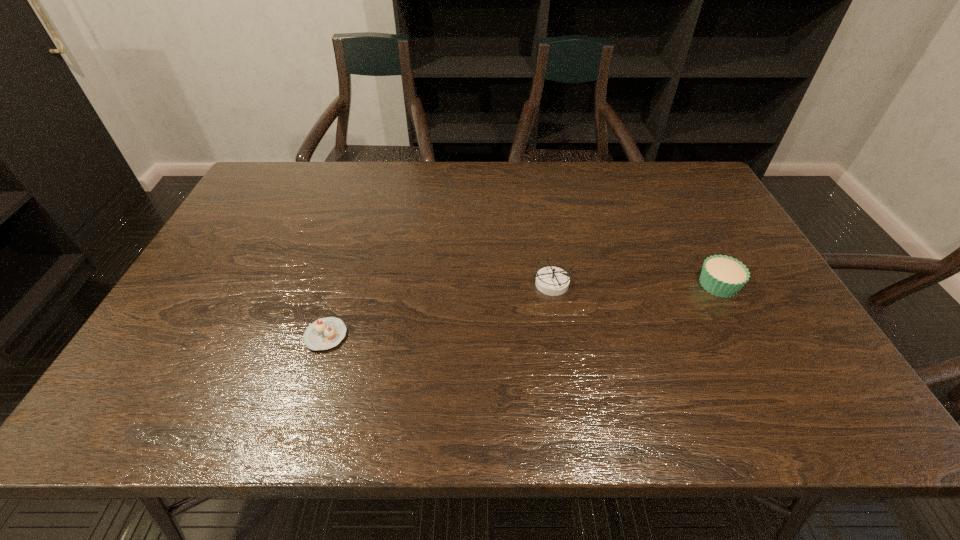
This screenshot has height=540, width=960. In order to click on empty location between the right cupcake and the shortest object in this screenshot , I will do `click(522, 310)`.

The height and width of the screenshot is (540, 960). Identify the location of free spot between the farther cupcake and the second object from right to left. (635, 284).

What are the coordinates of `empty location between the compass and the farther cupcake` in the screenshot? It's located at (635, 284).

Point out which object is positioned as the second nearest to the compass. Please provide its 2D coordinates. Your answer should be formatted as a tuple, i.e. [(x, y)], where the tuple contains the x and y coordinates of a point satisfying the conditions above.

[(325, 333)]

I want to click on the second closest object to the left cupcake, so click(x=723, y=276).

The image size is (960, 540). I want to click on free region that satisfies the following two spatial constraints: 1. on the front side of the farther cupcake; 2. on the left side of the second object from right to left, so click(551, 285).

Locate an element on the screen. vacant area in the image that satisfies the following two spatial constraints: 1. on the front side of the farther cupcake; 2. on the left side of the second object from right to left is located at coordinates (551, 285).

At what (x,y) coordinates should I click in order to perform the action: click on free space that satisfies the following two spatial constraints: 1. on the back side of the nearer cupcake; 2. on the left side of the compass. Please return your answer as a coordinate pair (x, y). Image resolution: width=960 pixels, height=540 pixels. Looking at the image, I should click on (342, 284).

This screenshot has width=960, height=540. I want to click on free space that satisfies the following two spatial constraints: 1. on the front side of the compass; 2. on the left side of the farther cupcake, so (x=551, y=285).

Find the location of a particular element. blank space that satisfies the following two spatial constraints: 1. on the back side of the nearest object; 2. on the left side of the compass is located at coordinates (342, 284).